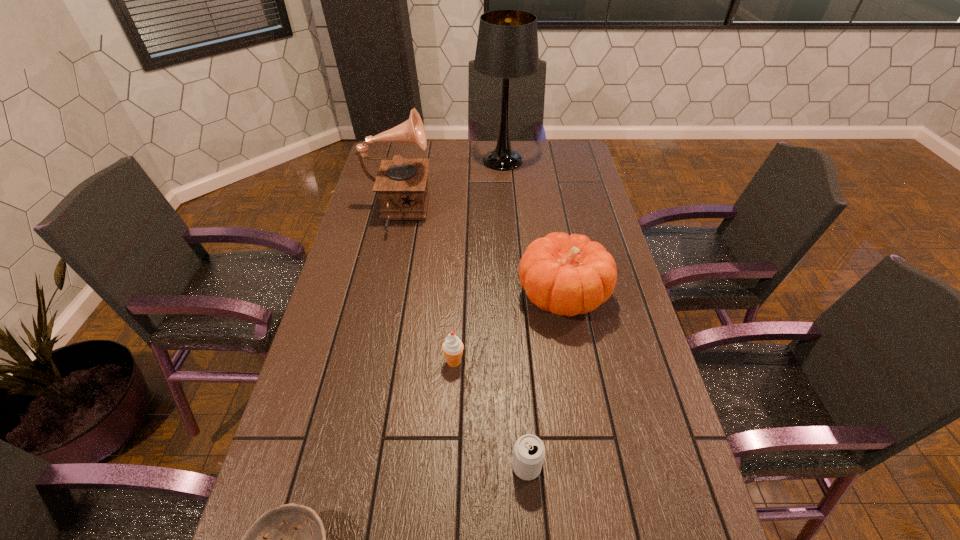
Locate an element on the screen. The image size is (960, 540). the tallest object is located at coordinates (507, 46).

This screenshot has height=540, width=960. Find the location of `the farthest object`. the farthest object is located at coordinates (507, 46).

At what (x,y) coordinates should I click in order to perform the action: click on record player. Please return your answer as a coordinate pair (x, y). Looking at the image, I should click on [x=401, y=183].

This screenshot has height=540, width=960. In order to click on the fifth shortest object in this screenshot , I will do `click(401, 183)`.

The height and width of the screenshot is (540, 960). I want to click on the third tallest object, so click(567, 275).

Locate an element on the screen. The width and height of the screenshot is (960, 540). the fourth nearest object is located at coordinates (567, 275).

The height and width of the screenshot is (540, 960). In order to click on icecream in this screenshot , I will do `click(453, 348)`.

Locate an element on the screen. The width and height of the screenshot is (960, 540). the fourth object from right to left is located at coordinates (453, 348).

What are the coordinates of `can` in the screenshot? It's located at (529, 451).

The height and width of the screenshot is (540, 960). I want to click on the fifth farthest object, so click(529, 451).